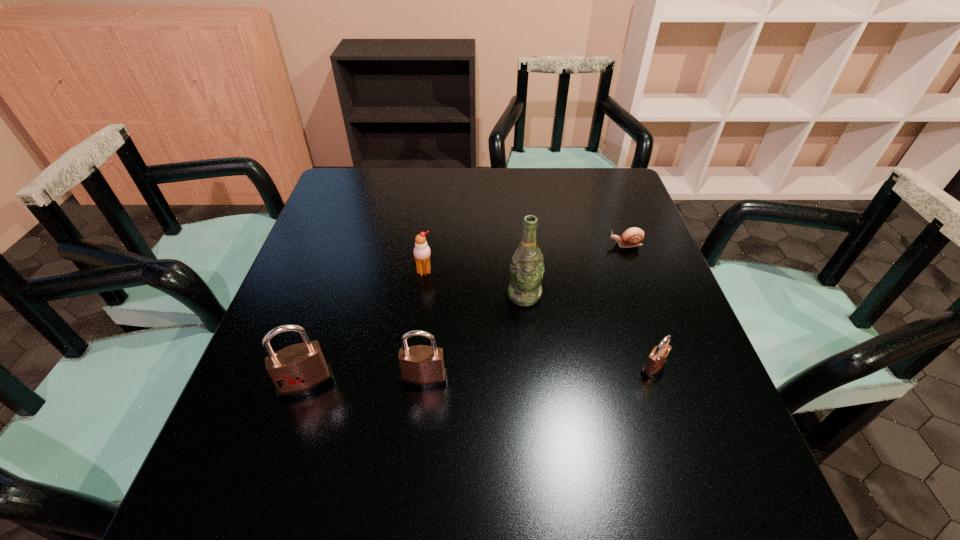
I want to click on padlock present at the right edge, so click(x=657, y=359).

Find the location of `escargot present at the right edge`. escargot present at the right edge is located at coordinates (632, 237).

The height and width of the screenshot is (540, 960). I want to click on vacant area at the far edge, so click(x=446, y=207).

At what (x,y) coordinates should I click in order to perform the action: click on blank area at the left edge. Please return your answer as a coordinate pair (x, y). Image resolution: width=960 pixels, height=540 pixels. Looking at the image, I should click on (311, 274).

You are a GUI agent. You are given a task and a screenshot of the screen. Output one action in this format:
    pyautogui.click(x=<x>, y=<y>)
    Task: Click on the free spot at the right edge of the desktop
    This screenshot has height=540, width=960.
    Given the screenshot: What is the action you would take?
    pyautogui.click(x=652, y=394)

In the image, there is a desktop. Where is `free space at the near left corner`? This screenshot has width=960, height=540. free space at the near left corner is located at coordinates (241, 435).

Identify the location of vacant space at the far right corner of the desktop. This screenshot has width=960, height=540. (625, 186).

Where is `vacant space at the near right corner`? vacant space at the near right corner is located at coordinates (718, 446).

The image size is (960, 540). I want to click on empty space between the fifth tallest object and the fourth nearest object, so click(x=588, y=332).

Locate an element on the screen. free space between the second tallest padlock and the beer bottle is located at coordinates (474, 338).